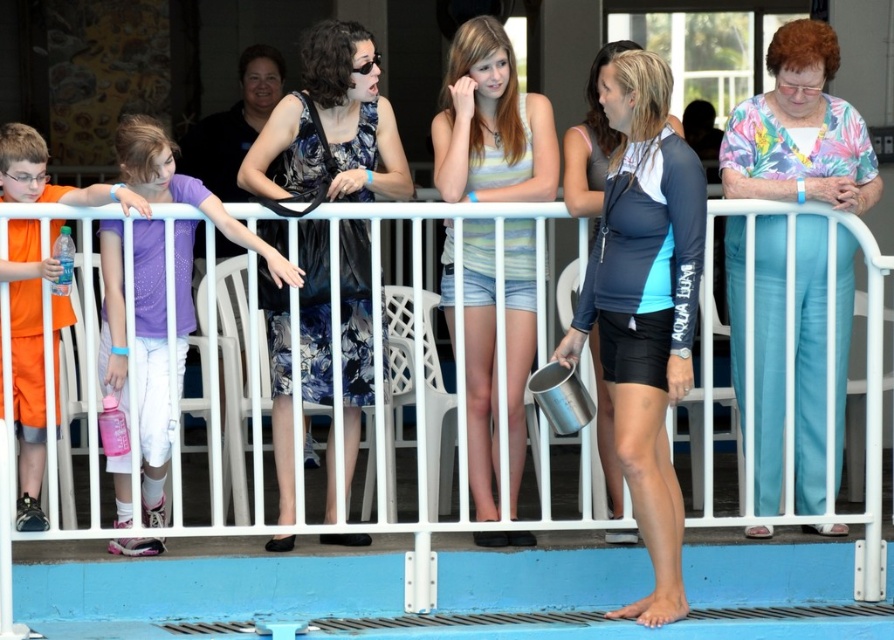
Is white metal fence at center smaller than purple matte shirt at left?

Indeed, white metal fence at center has a smaller size compared to purple matte shirt at left.

Based on the photo, does white metal fence at center appear over purple matte shirt at left?

No.

Does point (558, 568) come farther from viewer compared to point (141, 280)?

Yes.

The height and width of the screenshot is (640, 894). I want to click on white metal fence at center, so coord(179,536).

Is floral fabric blouse at right further to camera compared to striped tank top at center?

That is False.

Can you confirm if floral fabric blouse at right is positioned to the right of striped tank top at center?

Yes, floral fabric blouse at right is to the right of striped tank top at center.

Who is more forward, (833, 166) or (516, 390)?

Point (516, 390) is more forward.

Find the location of a particular element. The height and width of the screenshot is (640, 894). floral fabric blouse at right is located at coordinates point(799,131).

Which is behind, point (790, 592) or point (850, 323)?

Point (850, 323)

Who is higher up, white metal fence at center or floral fabric blouse at right?

floral fabric blouse at right is higher up.

Locate an element on the screen. white metal fence at center is located at coordinates (179, 536).